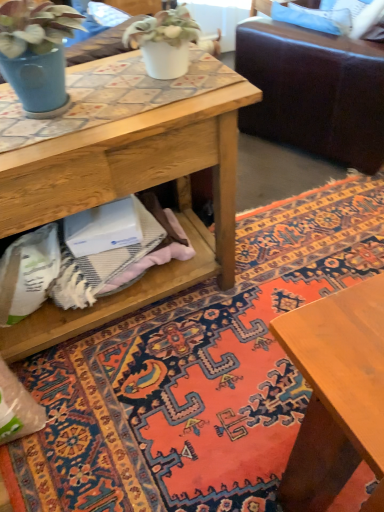
Question: Should I look upward or downward to see carpet with intricate patterns at center?

Choices:
 (A) up
 (B) down

Answer: (A)